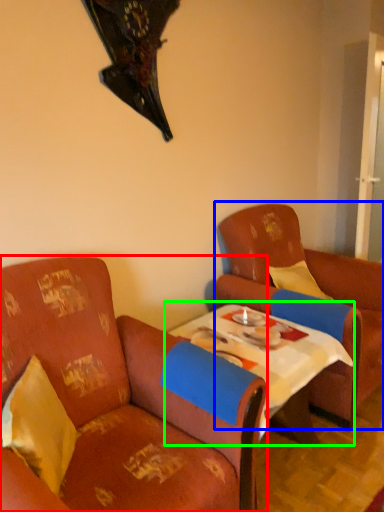
Question: Which object is positioned closest to chair (highlighted by a red box)? Select from chair (highlighted by a blue box) and table (highlighted by a green box).

Choices:
 (A) chair
 (B) table

Answer: (B)